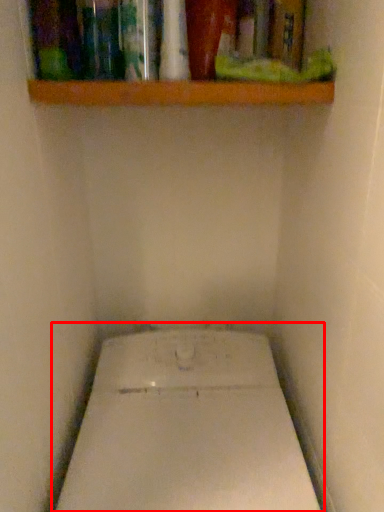
Question: From the image's perspective, what is the correct spatial relationship of toilet (annotated by the red box) in relation to shelf?

Choices:
 (A) below
 (B) above

Answer: (A)